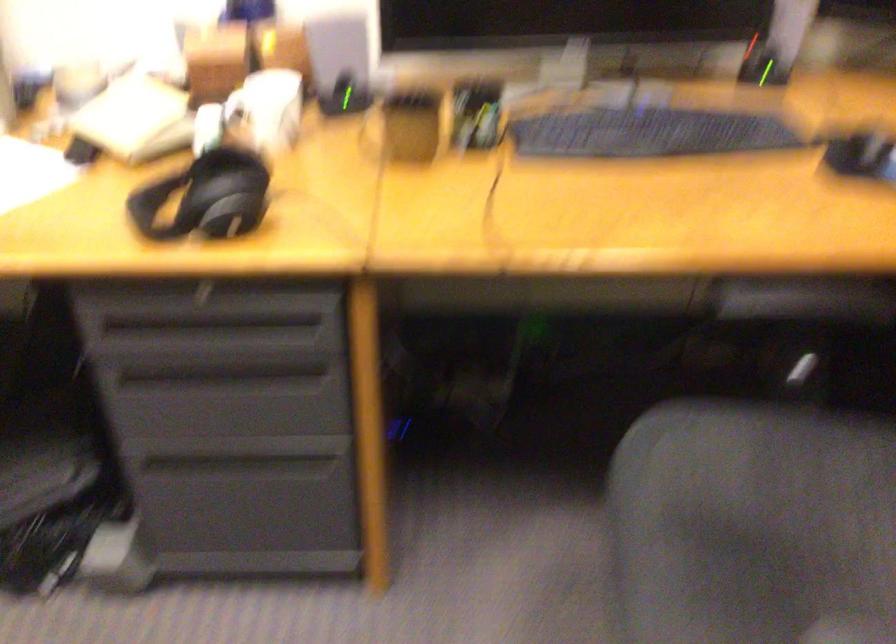
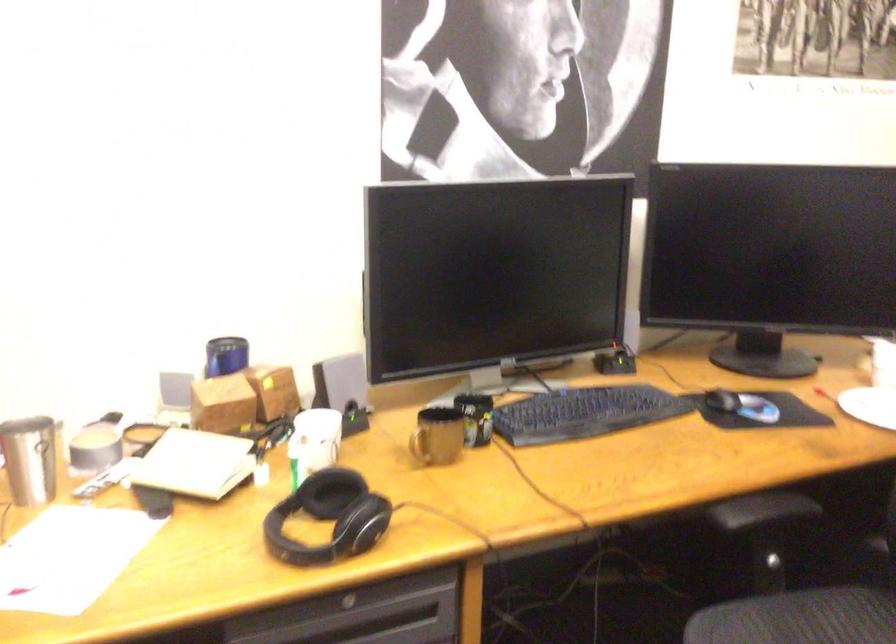
Where in the second image is the point corresponding to pixel 349 91 from the first image?

(352, 413)